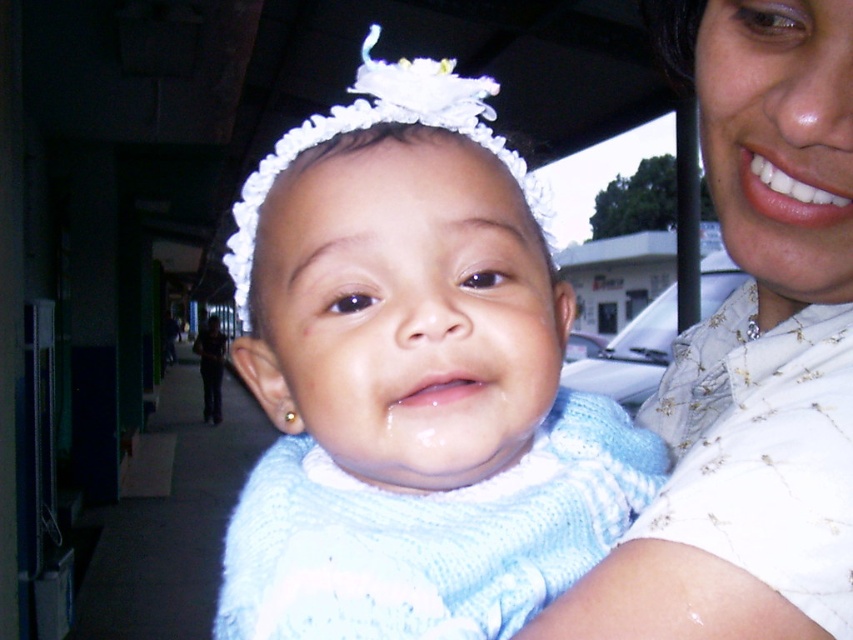
Which of these two, light blue knitted sweater at center or white quilted shirt at upper right, stands shorter?

With less height is white quilted shirt at upper right.

Who is lower down, light blue knitted sweater at center or white quilted shirt at upper right?

light blue knitted sweater at center

Which is behind, point (532, 508) or point (677, 476)?

The point (677, 476) is more distant.

The image size is (853, 640). In order to click on light blue knitted sweater at center in this screenshot , I will do `click(412, 381)`.